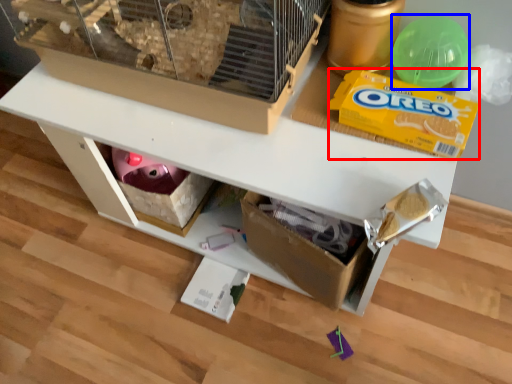
Question: Among these objects, which one is nearest to the camera, cereal (highlighted by a red box) or toy (highlighted by a blue box)?

Choices:
 (A) cereal
 (B) toy

Answer: (A)